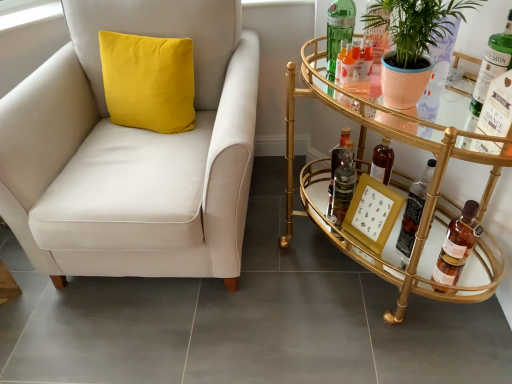
What is the approximate height of green glass bottle at upper right, acting as the 2th bottle starting from the right?

green glass bottle at upper right, acting as the 2th bottle starting from the right, is 10.97 inches in height.

Describe the element at coordinates (340, 61) in the screenshot. I see `green glass bottle at upper right, the 5th bottle from the right` at that location.

The height and width of the screenshot is (384, 512). In order to click on brown glass bottle at lower right, which appears as the first bottle when viewed from the right in this screenshot , I will do [x=457, y=245].

This screenshot has height=384, width=512. I want to click on translucent glass bottle at right, which is the third bottle in left-to-right order, so click(497, 108).

Measure the distance between point (x=313, y=207) and camera.

Point (x=313, y=207) and camera are 1.62 meters apart from each other.

You are a GUI agent. You are given a task and a screenshot of the screen. Output one action in this format:
    pyautogui.click(x=<x>, y=<y>)
    Task: Click on the translucent glass bottle at center
    
    Given the screenshot: What is the action you would take?
    pyautogui.click(x=336, y=164)

Is the position of translucent glass bottle at right, which is the fourth bottle from right to left, more distant than that of translucent glass bottle at lower right, arranged as the 3th bottle when viewed from the right?

No, the depth of translucent glass bottle at right, which is the fourth bottle from right to left, is less than that of translucent glass bottle at lower right, arranged as the 3th bottle when viewed from the right.

Is translucent glass bottle at right, which is the fourth bottle from right to left, facing away from translucent glass bottle at lower right, arranged as the 3th bottle when viewed from the right?

translucent glass bottle at right, which is the fourth bottle from right to left, does not have its back to translucent glass bottle at lower right, arranged as the 3th bottle when viewed from the right.

From a real-world perspective, which object stands above the other?

From a 3D spatial view, translucent glass bottle at right, which is the third bottle in left-to-right order, is above.

From the image's perspective, which is below, translucent glass bottle at right, which is the fourth bottle from right to left, or translucent glass bottle at lower right, arranged as the 3th bottle when viewed from the right?

translucent glass bottle at lower right, arranged as the 3th bottle when viewed from the right, is shown below in the image.

Is translucent glass bottle at center next to green glass bottle at upper right, which is the first bottle in left-to-right order?

No.

Can you confirm if translucent glass bottle at center is positioned to the left of green glass bottle at upper right, positioned as the 6th bottle in right-to-left order?

No.

Measure the distance from translucent glass bottle at center to green glass bottle at upper right, which is the first bottle in left-to-right order.

translucent glass bottle at center is 19.26 inches from green glass bottle at upper right, which is the first bottle in left-to-right order.

From a real-world perspective, is translucent glass bottle at center positioned above or below green glass bottle at upper right, positioned as the 6th bottle in right-to-left order?

translucent glass bottle at center is situated lower than green glass bottle at upper right, positioned as the 6th bottle in right-to-left order, in the real world.

Consider the image. Is translucent glass bottle at center smaller than matte peach pot at right?

Correct, translucent glass bottle at center occupies less space than matte peach pot at right.

Is point (333, 161) farther from viewer compared to point (390, 99)?

Yes.

Based on the photo, is translucent glass bottle at center oriented towards matte peach pot at right?

No, translucent glass bottle at center does not turn towards matte peach pot at right.

From a real-world perspective, which object stands above the other?

matte peach pot at right, from a real-world perspective.

Considering their positions, is translucent glass bottle at right, which is the third bottle in left-to-right order, located in front of or behind matte peach pot at right?

In the image, translucent glass bottle at right, which is the third bottle in left-to-right order, appears behind matte peach pot at right.

Is translucent glass bottle at right, which is the third bottle in left-to-right order, beside matte peach pot at right?

No, translucent glass bottle at right, which is the third bottle in left-to-right order, is not with matte peach pot at right.

Who is bigger, translucent glass bottle at right, which is the fourth bottle from right to left, or matte peach pot at right?

Bigger between the two is matte peach pot at right.

From the image's perspective, count 1st bottles downward from the matte peach pot at right and point to it. Please provide its 2D coordinates.

[(485, 82)]

Which is more to the left, green glass bottle at upper right, acting as the 5th bottle starting from the left, or matte peach pot at right?

Positioned to the left is matte peach pot at right.

Between green glass bottle at upper right, acting as the 5th bottle starting from the left, and matte peach pot at right, which one has larger width?

matte peach pot at right is wider.

Would you say green glass bottle at upper right, acting as the 2th bottle starting from the right, contains matte peach pot at right?

No, matte peach pot at right is not inside green glass bottle at upper right, acting as the 2th bottle starting from the right.

Which object is wider, gold mirrored bar cart at right or green glass bottle at upper right, the 5th bottle from the right?

gold mirrored bar cart at right.

Considering the relative sizes of gold mirrored bar cart at right and green glass bottle at upper right, the 5th bottle from the right, in the image provided, is gold mirrored bar cart at right smaller than green glass bottle at upper right, the 5th bottle from the right,?

Actually, gold mirrored bar cart at right might be larger than green glass bottle at upper right, the 5th bottle from the right.

Which object is positioned more to the right, gold mirrored bar cart at right or green glass bottle at upper right, the second bottle viewed from the left?

gold mirrored bar cart at right.

Which point is more forward, (432, 8) or (331, 11)?

The point (432, 8) is more forward.

Between matte peach pot at right and green glass bottle at upper right, which is the first bottle in left-to-right order, which one is positioned behind?

green glass bottle at upper right, which is the first bottle in left-to-right order, is further away from the camera.

From a real-world perspective, is matte peach pot at right under green glass bottle at upper right, positioned as the 6th bottle in right-to-left order?

Incorrect, from a real-world perspective, matte peach pot at right is higher than green glass bottle at upper right, positioned as the 6th bottle in right-to-left order.

Who is bigger, matte peach pot at right or green glass bottle at upper right, positioned as the 6th bottle in right-to-left order?

With larger size is matte peach pot at right.

Identify the location of the 5th bottle in front of the translucent glass bottle at lower right, which is the fourth bottle from left to right, starting your count from the anchor. Image resolution: width=512 pixels, height=384 pixels. (x=497, y=108).

What are the coordinates of `beer bottle on the right side of green glass bottle at upper right, positioned as the 6th bottle in right-to-left order` in the screenshot? It's located at (336, 164).

Looking at this image, estimate the real-world distances between objects in this image. Which object is further from matte peach pot at right, brown glass bottle at lower right, which appears as the first bottle when viewed from the right, or matte white armchair at center?

matte white armchair at center is positioned further to the anchor matte peach pot at right.

Looking at the image, which one is located further to green glass bottle at upper right, the 5th bottle from the right, matte peach pot at right or translucent glass bottle at center?

translucent glass bottle at center is positioned further to the anchor green glass bottle at upper right, the 5th bottle from the right.

Considering their positions, is translucent glass bottle at lower right, which is the fourth bottle from left to right, positioned further to translucent glass bottle at center than green glass bottle at upper right, which is the first bottle in left-to-right order?

green glass bottle at upper right, which is the first bottle in left-to-right order, lies further to translucent glass bottle at center than the other object.

Looking at the image, which one is located further to green glass bottle at upper right, the second bottle viewed from the left, brown glass bottle at lower right, which appears as the sixth bottle when viewed from the left, or gold mirrored bar cart at right?

Based on the image, brown glass bottle at lower right, which appears as the sixth bottle when viewed from the left, appears to be further to green glass bottle at upper right, the second bottle viewed from the left.

Which object lies further to the anchor point green glass bottle at upper right, which is the first bottle in left-to-right order, gold mirrored bar cart at right or translucent glass bottle at center?

translucent glass bottle at center lies further to green glass bottle at upper right, which is the first bottle in left-to-right order, than the other object.

Considering their positions, is green glass bottle at upper right, the 5th bottle from the right, positioned closer to translucent glass bottle at center than green glass bottle at upper right, acting as the 5th bottle starting from the left?

green glass bottle at upper right, the 5th bottle from the right.

From the image, which object appears to be nearer to matte peach pot at right, translucent glass bottle at right, which is the third bottle in left-to-right order, or green glass bottle at upper right, the second bottle viewed from the left?

Among the two, translucent glass bottle at right, which is the third bottle in left-to-right order, is located nearer to matte peach pot at right.

From the image, which object appears to be nearer to matte white armchair at center, green glass bottle at upper right, the second bottle viewed from the left, or gold mirrored bar cart at right?

Among the two, gold mirrored bar cart at right is located nearer to matte white armchair at center.

You are a GUI agent. You are given a task and a screenshot of the screen. Output one action in this format:
    pyautogui.click(x=<x>, y=<y>)
    Task: Click on the beer bottle situated between matte white armchair at center and brown glass bottle at lower right, which appears as the sixth bottle when viewed from the left, from left to right
    This screenshot has width=512, height=384.
    Given the screenshot: What is the action you would take?
    pyautogui.click(x=336, y=164)

Locate an element on the screen. Image resolution: width=512 pixels, height=384 pixels. table situated between matte white armchair at center and translucent glass bottle at right, which is the fourth bottle from right to left, from left to right is located at coordinates (362, 171).

You are a GUI agent. You are given a task and a screenshot of the screen. Output one action in this format:
    pyautogui.click(x=<x>, y=<y>)
    Task: Click on the houseplant located between gold mirrored bar cart at right and translucent glass bottle at center in the depth direction
    The image size is (512, 384).
    Given the screenshot: What is the action you would take?
    pyautogui.click(x=415, y=27)

Where is `table that lies between matte peach pot at right and brown glass bottle at lower right, which appears as the sixth bottle when viewed from the left, from top to bottom`? table that lies between matte peach pot at right and brown glass bottle at lower right, which appears as the sixth bottle when viewed from the left, from top to bottom is located at coordinates (362, 171).